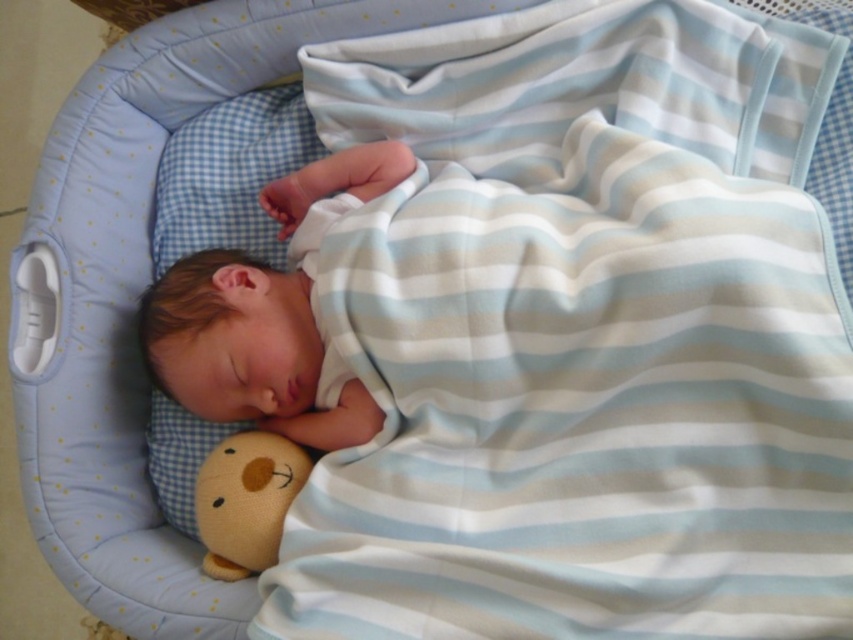
You are a babysitter who needs to check on the baby. The bassinet is placed near a window. To ensure safety, you must confirm the distance between the white soft newborn at center and the soft yellow plush bear at lower left. Is the newborn positioned to the right or left side of the bear?

The white soft newborn at center is positioned on the right side of the soft yellow plush bear at lower left, so the newborn is to the right of the bear.

You are a parent checking on your baby in the bassinet. You notice the white soft newborn at center and the soft yellow plush bear at lower left. Which object is positioned higher in the bassinet?

The white soft newborn at center is positioned higher than the soft yellow plush bear at lower left in the bassinet.

You are a parent trying to place the soft yellow plush bear at lower left into a small storage basket next to the white soft newborn at center. Based on their sizes, will the bear fit without overlapping the newborn?

The white soft newborn at center might be wider than soft yellow plush bear at lower left, so there is a possibility that the bear could fit without overlapping, but there is uncertainty due to the newborn potentially being wider.